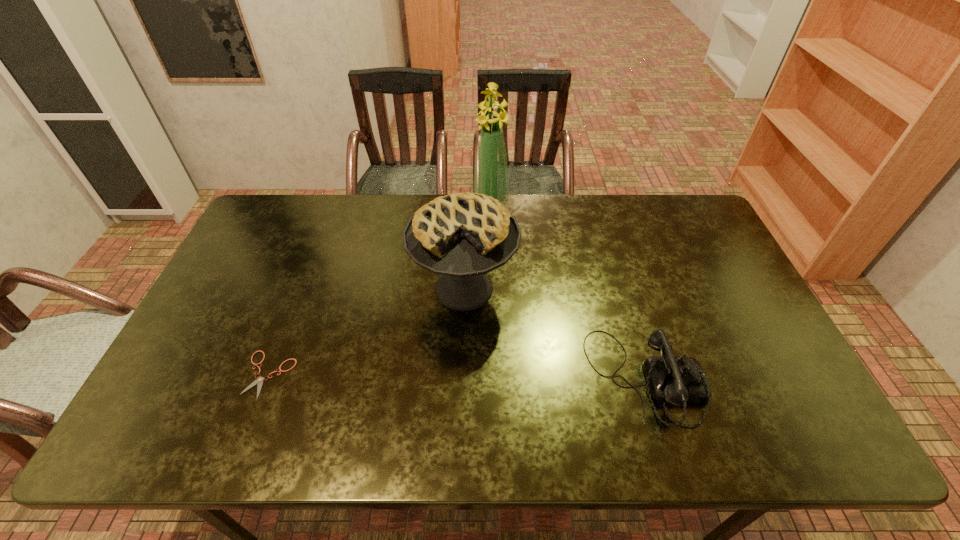
The image size is (960, 540). Find the location of `vacant point that satisfies the following two spatial constraints: 1. on the back side of the third shortest object; 2. on the left side of the tallest object`. vacant point that satisfies the following two spatial constraints: 1. on the back side of the third shortest object; 2. on the left side of the tallest object is located at coordinates (467, 206).

The image size is (960, 540). In order to click on free space that satisfies the following two spatial constraints: 1. on the back side of the shears; 2. on the right side of the pie in this screenshot , I will do `click(301, 289)`.

Locate an element on the screen. free location that satisfies the following two spatial constraints: 1. on the back side of the third shortest object; 2. on the left side of the tallest object is located at coordinates (467, 206).

Where is `vacant region that satisfies the following two spatial constraints: 1. on the front side of the rightmost object; 2. on the front-facing side of the second tallest object`? Image resolution: width=960 pixels, height=540 pixels. vacant region that satisfies the following two spatial constraints: 1. on the front side of the rightmost object; 2. on the front-facing side of the second tallest object is located at coordinates (461, 380).